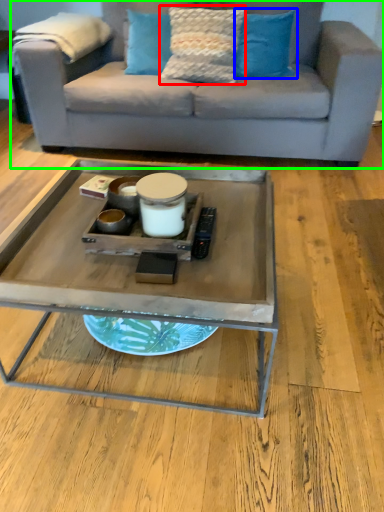
Question: Which is farther away from pillow (highlighted by a red box)? pillow (highlighted by a blue box) or studio couch (highlighted by a green box)?

Choices:
 (A) pillow
 (B) studio couch

Answer: (B)